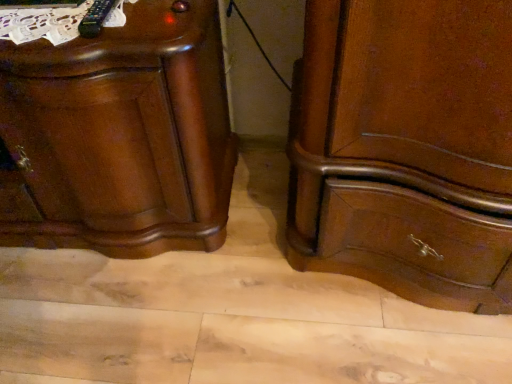
The height and width of the screenshot is (384, 512). Describe the element at coordinates (115, 130) in the screenshot. I see `matte wood chest of drawers at left` at that location.

At what (x,y) coordinates should I click in order to perform the action: click on matte wood chest of drawers at left. Please return your answer as a coordinate pair (x, y). Image resolution: width=512 pixels, height=384 pixels. Looking at the image, I should click on (115, 130).

This screenshot has height=384, width=512. I want to click on matte wood chest of drawers at left, so click(115, 130).